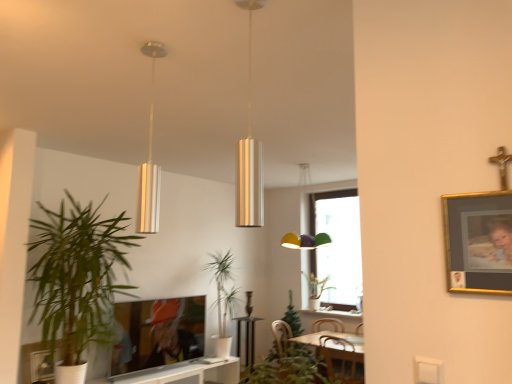
Question: Considering the positions of wooden swivel chair at lower center and green leafy plant at lower center, the 1th houseplant in the front-to-back sequence, in the image, is wooden swivel chair at lower center wider or thinner than green leafy plant at lower center, the 1th houseplant in the front-to-back sequence,?

Choices:
 (A) thin
 (B) wide

Answer: (B)

Question: Is wooden swivel chair at lower center inside or outside of green leafy plant at lower center, which is the 2th houseplant from right to left?

Choices:
 (A) inside
 (B) outside

Answer: (B)

Question: Which of these objects is positioned closest to the matte black tv at lower center, which ranks as the first picture frame in back-to-front order?

Choices:
 (A) green leafy plant at left, the 2th houseplant when ordered from front to back
 (B) green leafy plant at center, the second houseplant in the left-to-right sequence
 (C) gold-framed photo at upper right, the 1th picture frame in the top-to-bottom sequence
 (D) wooden swivel chair at lower center
 (E) metallic silver picture frame at lower left, which ranks as the 2th picture frame in front-to-back order

Answer: (A)

Question: Which object is positioned closest to the matte black tv at lower center, the first picture frame from the bottom?

Choices:
 (A) green leafy plant at lower center, the fourth houseplant in the back-to-front sequence
 (B) metallic silver pendant light at upper center, arranged as the 2th lamp when viewed from the right
 (C) metallic silver picture frame at lower left, the first picture frame viewed from the left
 (D) green leafy plant at center, the second houseplant in the left-to-right sequence
 (E) metallic cylinder at center, the second lamp when ordered from back to front

Answer: (D)